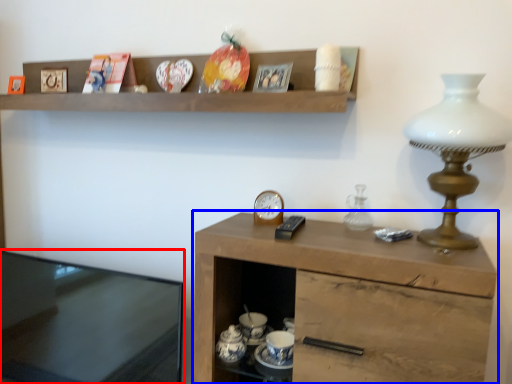
Question: Which object appears farthest to the camera in this image, desk (highlighted by a red box) or cabinetry (highlighted by a blue box)?

Choices:
 (A) desk
 (B) cabinetry

Answer: (A)